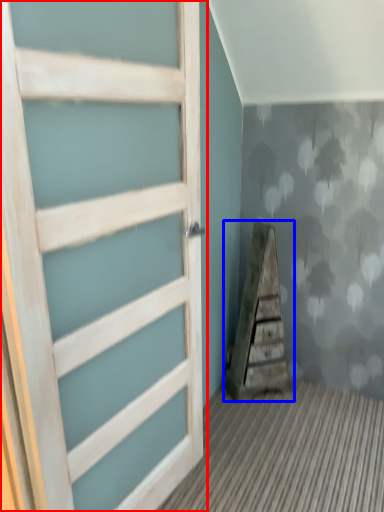
Question: Which point is closer to the camera, door (highlighted by a red box) or stairwell (highlighted by a blue box)?

Choices:
 (A) door
 (B) stairwell

Answer: (A)